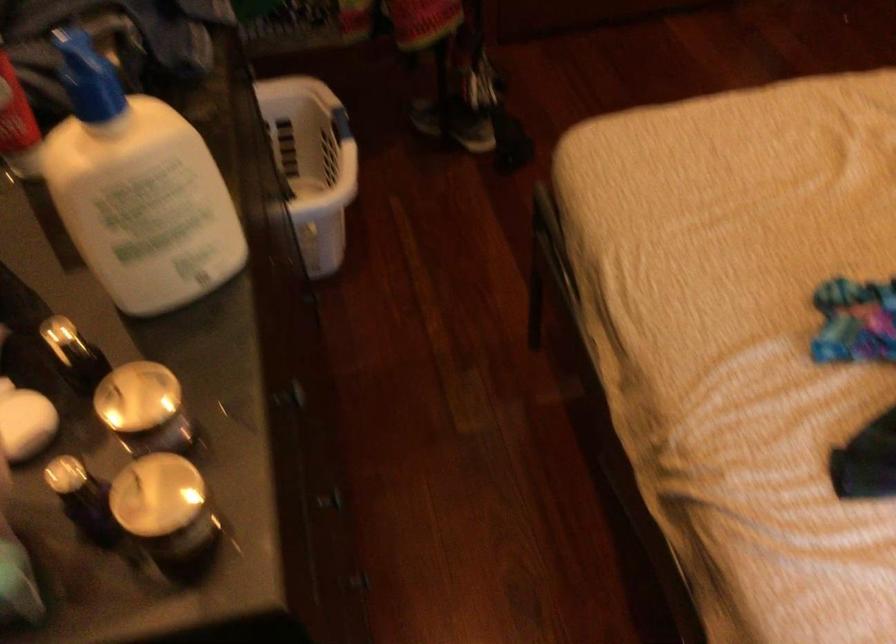
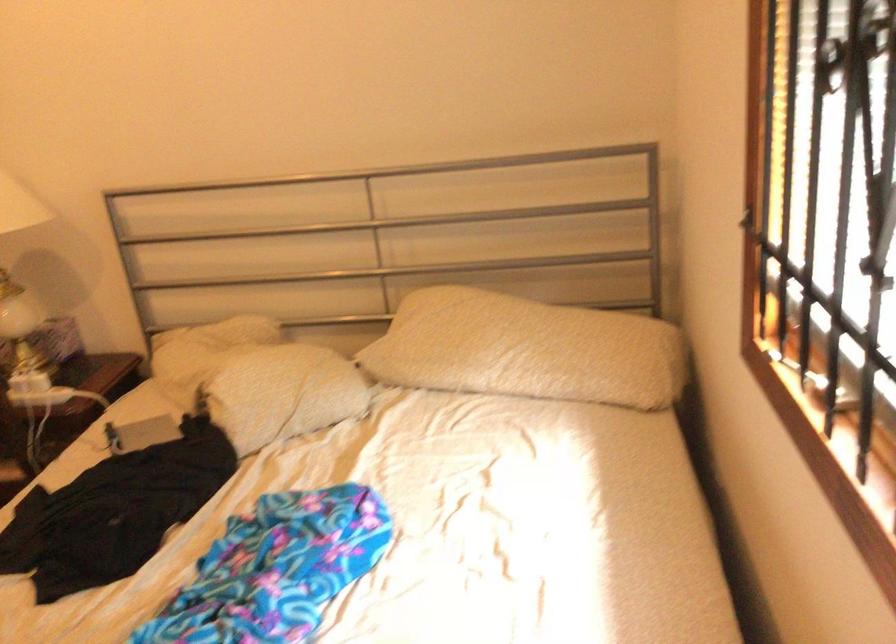
Question: The camera is either moving clockwise (left) or counter-clockwise (right) around the object. The first image is from the beginning of the video and the second image is from the end. Is the camera moving left or right when shooting the video?

Choices:
 (A) Left
 (B) Right

Answer: (A)